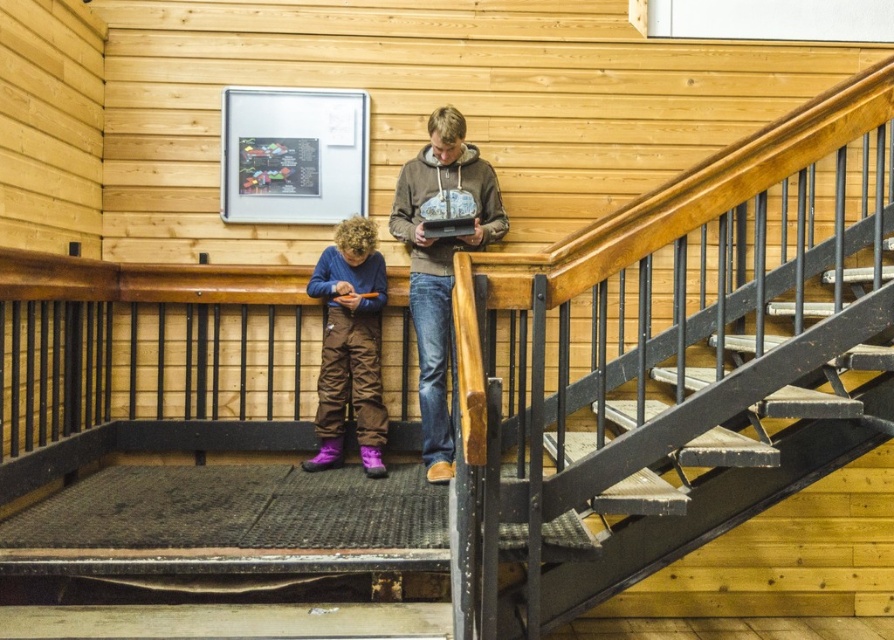
From the picture: Is matte brown hoodie at center to the right of purple quilted snowsuit at center from the viewer's perspective?

Yes, matte brown hoodie at center is to the right of purple quilted snowsuit at center.

Where is `matte brown hoodie at center`? matte brown hoodie at center is located at coordinates (441, 259).